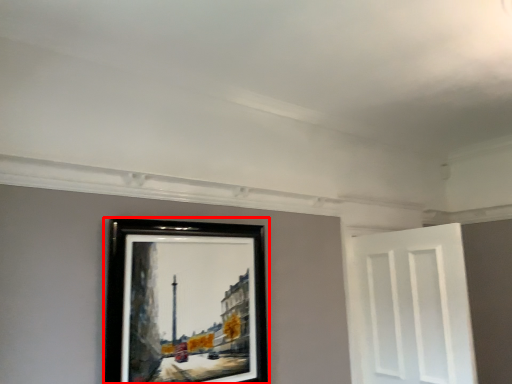
Question: From the image's perspective, considering the relative positions of picture frame (annotated by the red box) and door in the image provided, where is picture frame (annotated by the red box) located with respect to the staircase?

Choices:
 (A) above
 (B) below

Answer: (A)